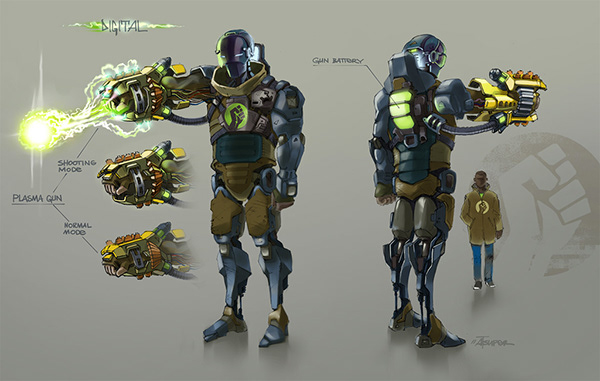
What are the coordinates of `plasma ball` in the screenshot? It's located at (35, 130).